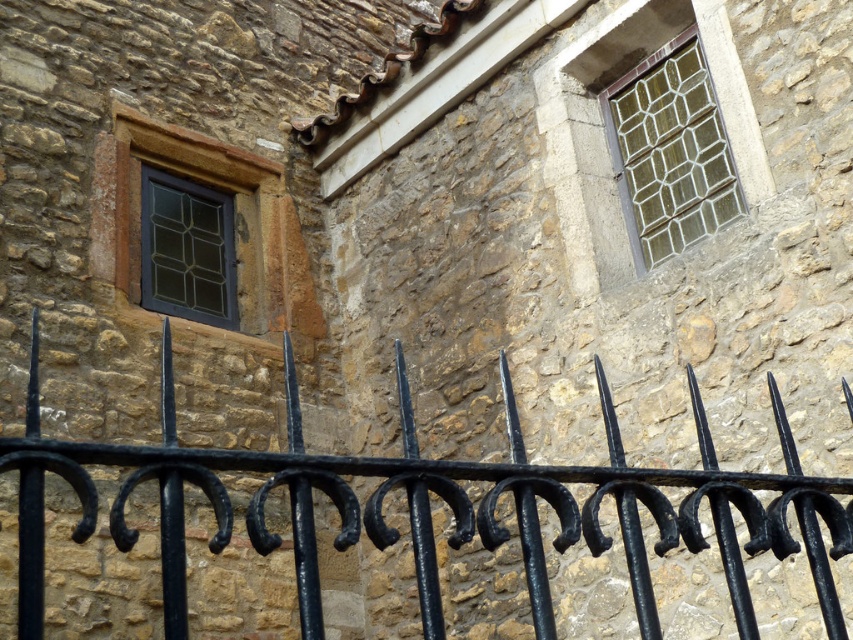
You are a painter standing at the base of the stone building. You need to paint both the black wrought iron fence at upper center and the matte black window at upper left. Given that your ladder can only safely reach up to 20 meters, can you reach both objects with your current ladder?

The black wrought iron fence at upper center is 25.78 meters from matte black window at upper left. Since the distance between them is greater than the ladder height limit of 20 meters, you cannot safely reach both objects with your current ladder.

You are standing in front of the stone building. Where is the matte black window at upper left located in terms of coordinates?

The matte black window at upper left is located at coordinates point (216, 189).

You are standing in front of the stone building and want to take a photo of the black wrought iron fence at upper center. Based on its 2D location coordinates, where should you position yourself to ensure the fence is centered in your camera view?

The black wrought iron fence at upper center is located at coordinates point (428, 506), so you should position yourself directly in front of the stone building at the point corresponding to these coordinates to center the fence in your camera view.